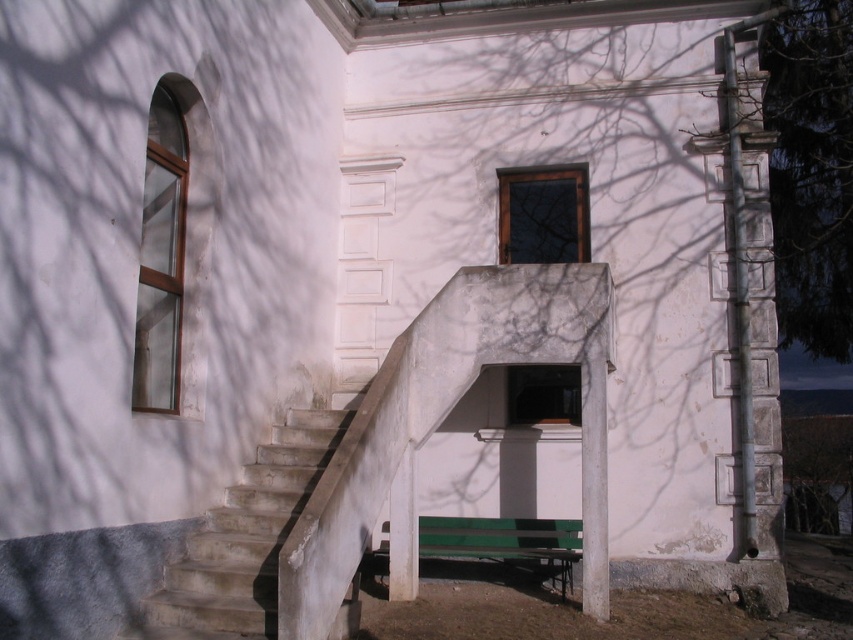
Is the position of concrete stairs at center more distant than that of green painted wood bench at lower center?

No.

Who is more distant from viewer, (163, 577) or (387, 528)?

Positioned behind is point (387, 528).

Find the location of `concrete stairs at center`. concrete stairs at center is located at coordinates coord(242,540).

Identify the location of green textured stone column at right. The height and width of the screenshot is (640, 853). (810, 170).

Who is higher up, green textured stone column at right or wooden window at upper center?

green textured stone column at right

Image resolution: width=853 pixels, height=640 pixels. What do you see at coordinates (810, 170) in the screenshot?
I see `green textured stone column at right` at bounding box center [810, 170].

The image size is (853, 640). Identify the location of green textured stone column at right. (810, 170).

From the picture: Measure the distance between clear glass window at left and camera.

A distance of 7.19 meters exists between clear glass window at left and camera.

Does clear glass window at left have a greater width compared to green painted wood bench at lower center?

No, clear glass window at left is not wider than green painted wood bench at lower center.

Between point (167, 278) and point (428, 529), which one is positioned behind?

The point (428, 529) is more distant.

At what (x,y) coordinates should I click in order to perform the action: click on clear glass window at left. Please return your answer as a coordinate pair (x, y). This screenshot has height=640, width=853. Looking at the image, I should click on (161, 259).